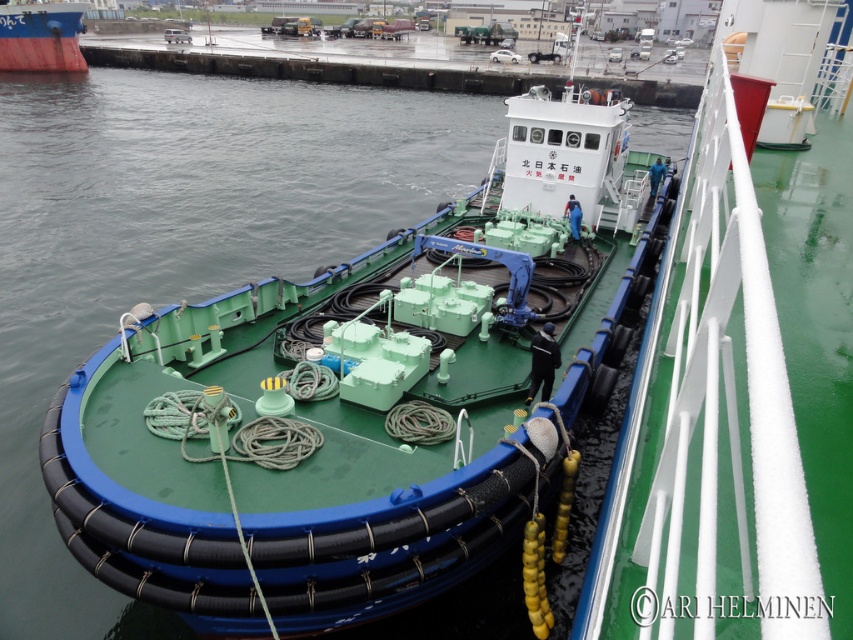
Question: Which object is closer to the camera taking this photo?

Choices:
 (A) red matte boat at upper left
 (B) green rubber boat at center

Answer: (B)

Question: From the image, what is the correct spatial relationship of green rubber boat at center in relation to red matte boat at upper left?

Choices:
 (A) left
 (B) right

Answer: (B)

Question: Which object appears farthest from the camera in this image?

Choices:
 (A) green rubber boat at center
 (B) red matte boat at upper left

Answer: (B)

Question: Is green rubber boat at center wider than red matte boat at upper left?

Choices:
 (A) yes
 (B) no

Answer: (B)

Question: Does green rubber boat at center have a smaller size compared to red matte boat at upper left?

Choices:
 (A) no
 (B) yes

Answer: (B)